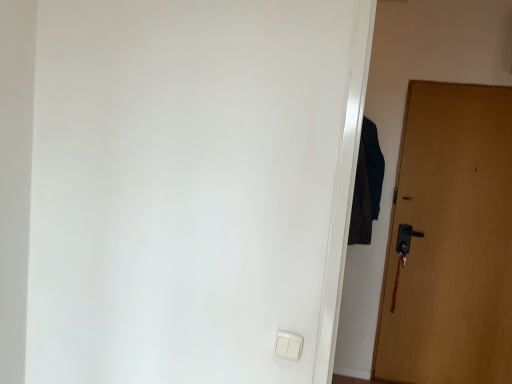
Question: From their relative heights in the image, would you say wooden door at right is taller or shorter than dark blue fabric at right?

Choices:
 (A) short
 (B) tall

Answer: (B)

Question: Is wooden door at right in front of or behind dark blue fabric at right in the image?

Choices:
 (A) front
 (B) behind

Answer: (B)

Question: Considering the real-world distances, which object is farthest from the white plastic light switch at lower center?

Choices:
 (A) wooden door at right
 (B) dark blue fabric at right

Answer: (A)

Question: Which of these objects is positioned closest to the white plastic light switch at lower center?

Choices:
 (A) dark blue fabric at right
 (B) wooden door at right

Answer: (A)